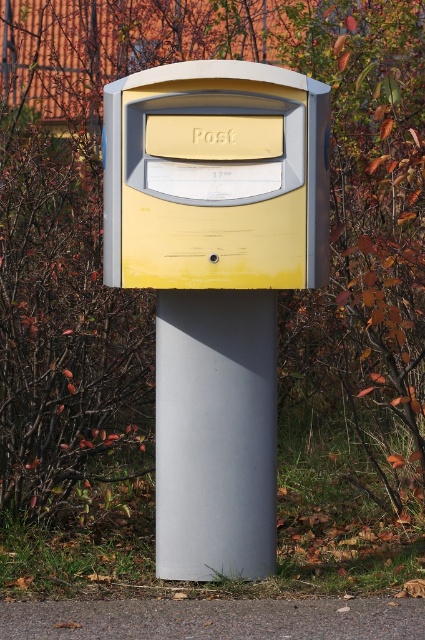
You are standing in a park and see the yellow matte mailbox at center. If you take three large steps forward, each step covering 2.5 feet, will you be able to reach the mailbox to drop off a letter?

The yellow matte mailbox at center is 18.29 feet away from viewer. Taking three large steps of 2.5 feet each would cover 7.5 feet, so you would still be 10.79 feet away from the mailbox and unable to reach it to drop off a letter.

You are a mail carrier trying to deliver a package to the yellow matte mailbox at center and the matte gray pole at center. Which object should you approach first if you want to reach the one on the left side first?

The yellow matte mailbox at center is positioned on the left side of the matte gray pole at center, so you should approach the yellow matte mailbox at center first.

You are a delivery person trying to place a large package into the yellow matte mailbox at center and the matte gray pole at center. Which one can you use to store the package?

The yellow matte mailbox at center has a larger size compared to the matte gray pole at center, so you can use the yellow matte mailbox at center to store the package since it has more space.